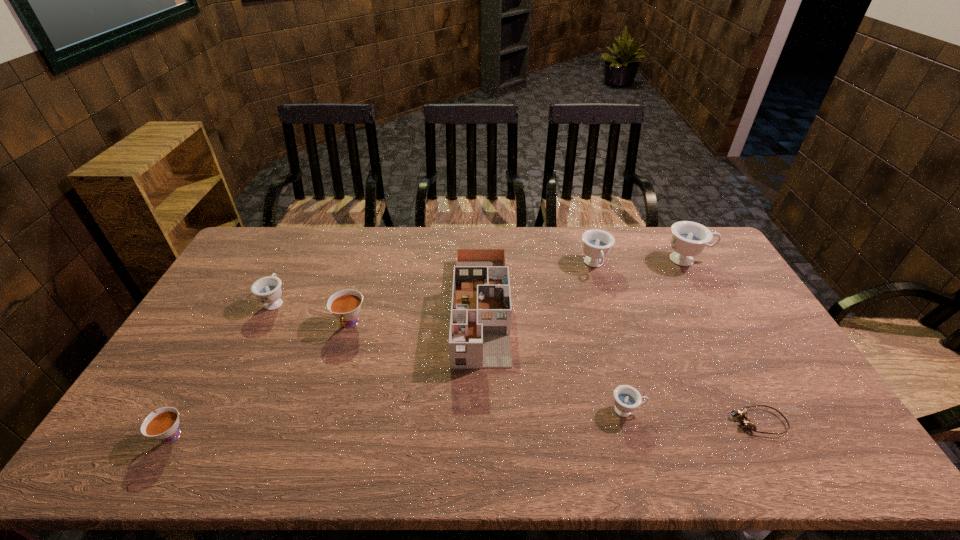
Where is `the leftmost object`? Image resolution: width=960 pixels, height=540 pixels. the leftmost object is located at coordinates (164, 425).

You are a GUI agent. You are given a task and a screenshot of the screen. Output one action in this format:
    pyautogui.click(x=<x>, y=<y>)
    Task: Click on the smallest blue teacup
    
    Given the screenshot: What is the action you would take?
    pyautogui.click(x=626, y=398)

Image resolution: width=960 pixels, height=540 pixels. Identify the location of goggles. (746, 423).

Locate an element on the screen. free space located at the front door of the white dollhouse is located at coordinates (482, 400).

Find the location of a particular element. vacant space located on the side of the second biggest blue teacup with the handle is located at coordinates (609, 311).

What are the coordinates of `vacant space located on the side of the bigger white teacup with the handle` in the screenshot? It's located at (325, 405).

Where is `vacant space located on the side of the second nearest blue teacup with the handle`? The width and height of the screenshot is (960, 540). vacant space located on the side of the second nearest blue teacup with the handle is located at coordinates (311, 230).

You are a GUI agent. You are given a task and a screenshot of the screen. Output one action in this format:
    pyautogui.click(x=<x>, y=<y>)
    Task: Click on the vacant region located 0.050m on the side of the second nearest blue teacup with the handle
    Image resolution: width=960 pixels, height=540 pixels.
    Given the screenshot: What is the action you would take?
    pyautogui.click(x=286, y=279)

Where is `free point located 0.110m on the side of the second nearest blue teacup with the handle`? free point located 0.110m on the side of the second nearest blue teacup with the handle is located at coordinates (292, 268).

Identify the location of vacant space situated on the side of the nearest blue teacup with the handle. (730, 410).